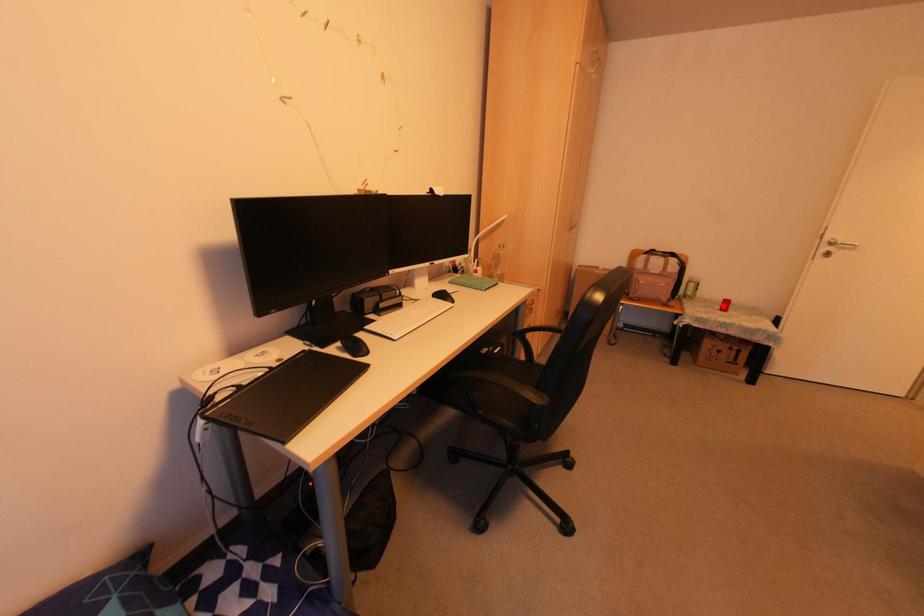
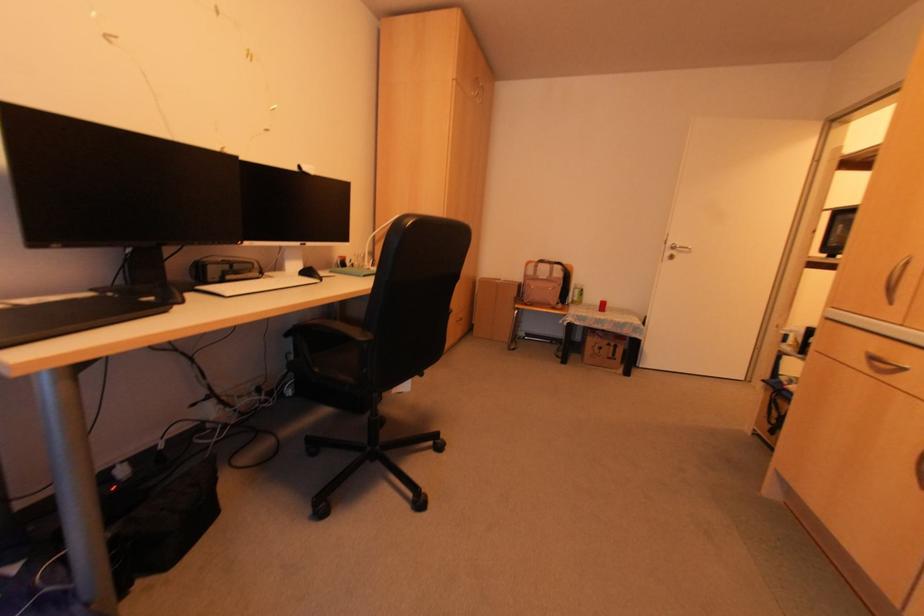
Find the pixel in the second image that matches the highlighted location in the first image.

(601, 307)